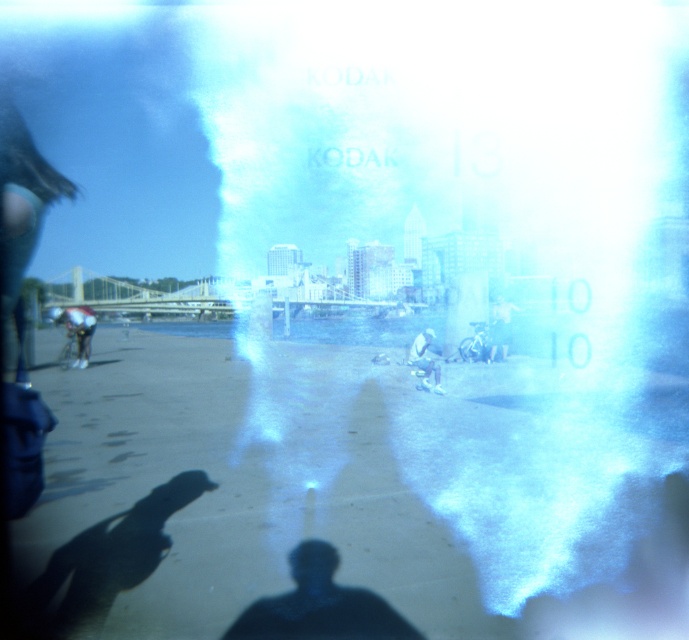
Question: Considering the real-world distances, which object is farthest from the white matte bicycle at center?

Choices:
 (A) black matte person at center
 (B) white plastic bag at center
 (C) smooth sand beach at center

Answer: (A)

Question: Among these objects, which one is nearest to the camera?

Choices:
 (A) white plastic bag at center
 (B) dark blue fabric cyclist at left
 (C) smooth sand beach at center

Answer: (C)

Question: Does black matte person at center have a smaller size compared to white matte bicycle at center?

Choices:
 (A) no
 (B) yes

Answer: (A)

Question: Can you confirm if smooth sand beach at center is bigger than black matte person at center?

Choices:
 (A) yes
 (B) no

Answer: (A)

Question: Based on their relative distances, which object is farther from the dark blue fabric cyclist at left?

Choices:
 (A) black matte person at center
 (B) white matte bicycle at center
 (C) white plastic bag at center
 (D) smooth sand beach at center

Answer: (A)

Question: Considering the relative positions of smooth sand beach at center and white matte bicycle at center in the image provided, where is smooth sand beach at center located with respect to white matte bicycle at center?

Choices:
 (A) left
 (B) right

Answer: (A)